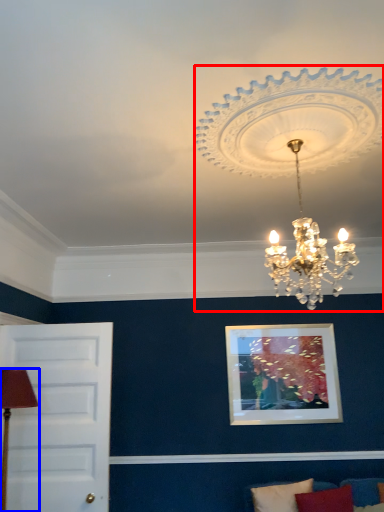
Question: Which point is further to the camera, lamp (highlighted by a red box) or table lamp (highlighted by a blue box)?

Choices:
 (A) lamp
 (B) table lamp

Answer: (B)